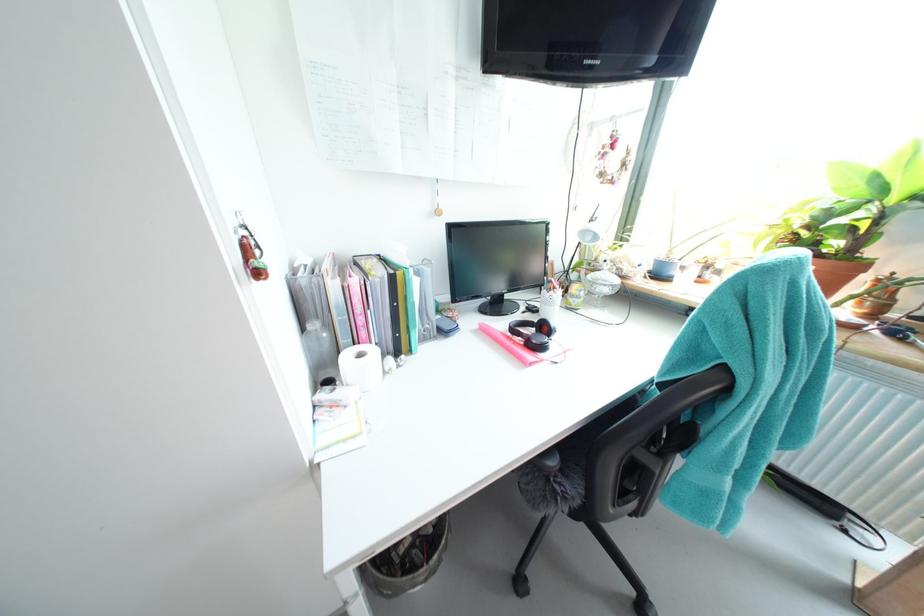
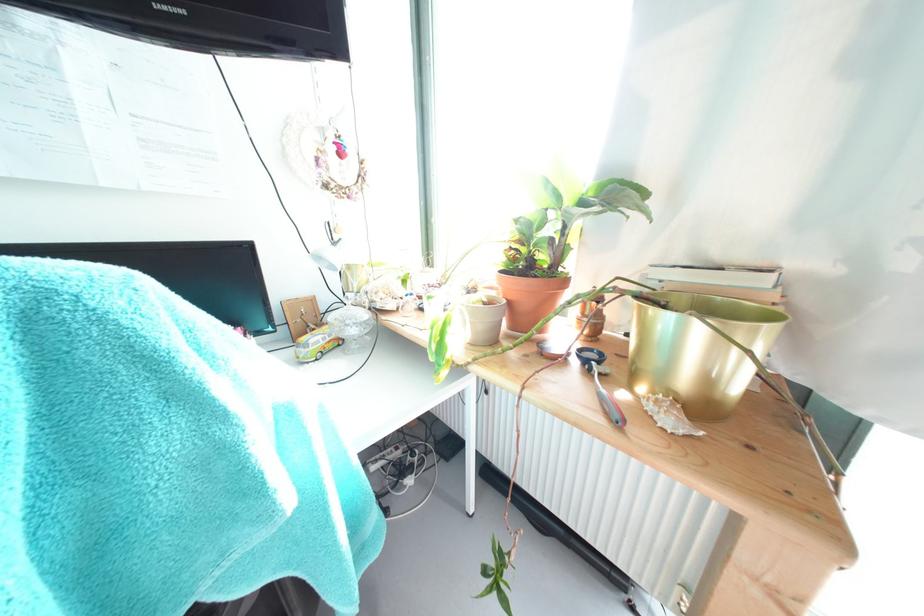
Question: The images are taken continuously from a first-person perspective. In which direction is your viewpoint rotating?

Choices:
 (A) Left
 (B) Right
 (C) Up
 (D) Down

Answer: (B)